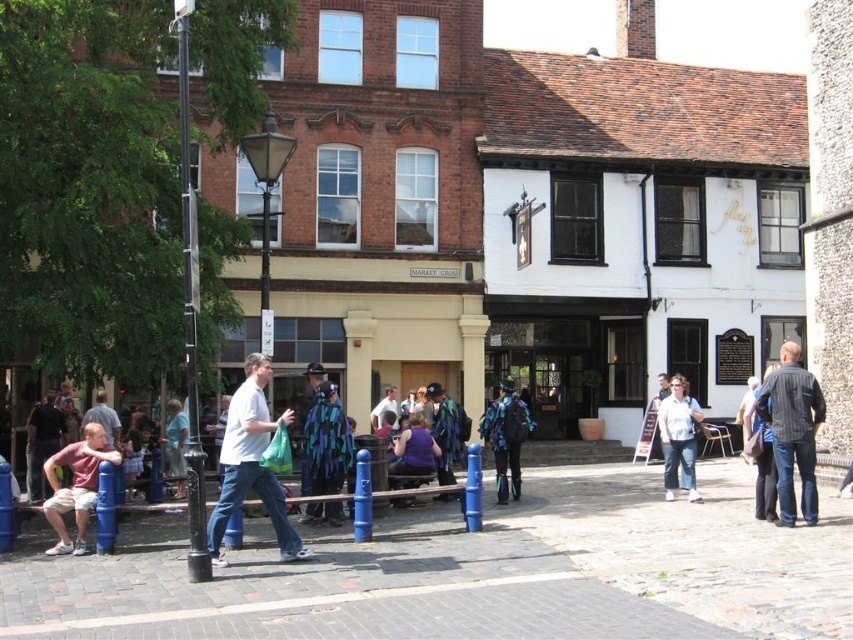
You are a photographer trying to capture both the shiny metallic costume at center and the shiny metallic jacket at center in a single frame. Which object should you focus on first to ensure both are in the frame?

You should focus on the shiny metallic jacket at center first because it is larger than the shiny metallic costume at center, ensuring it fits within the frame while also capturing the smaller one.

You are a photographer trying to capture both the matte pink shirt at lower left and the shiny metallic jacket at center in a single frame. Given their sizes, which one might you need to position closer to the camera to ensure both fit in the photo?

Since the matte pink shirt at lower left is narrower than the shiny metallic jacket at center, you would need to move the matte pink shirt at lower left closer to the camera to ensure both fit in the photo.

You are a photographer positioned at the back of the square. You want to take a photo that includes both the white matte shirt at center and the purple matte shirt at center. Which shirt should you adjust your focus on first to ensure both are in the frame?

You should focus on the white matte shirt at center first since it is closer to the viewer than the purple matte shirt at center, allowing you to adjust your framing to include both.